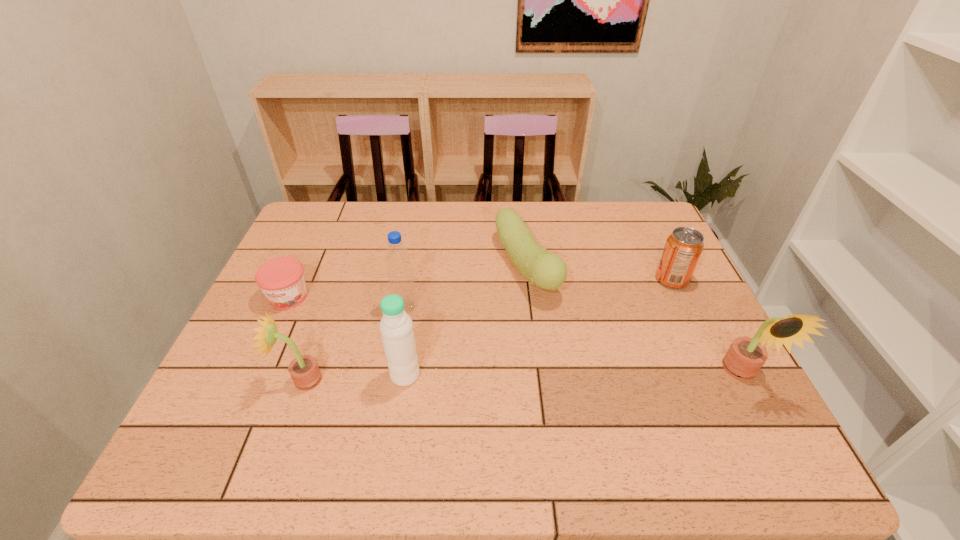
If we want them evenly spaced by inserting an extra sunflower among them, please locate a free spot for this new sunflower. Please provide its 2D coordinates. Your answer should be formatted as a tuple, i.e. [(x, y)], where the tuple contains the x and y coordinates of a point satisfying the conditions above.

[(524, 377)]